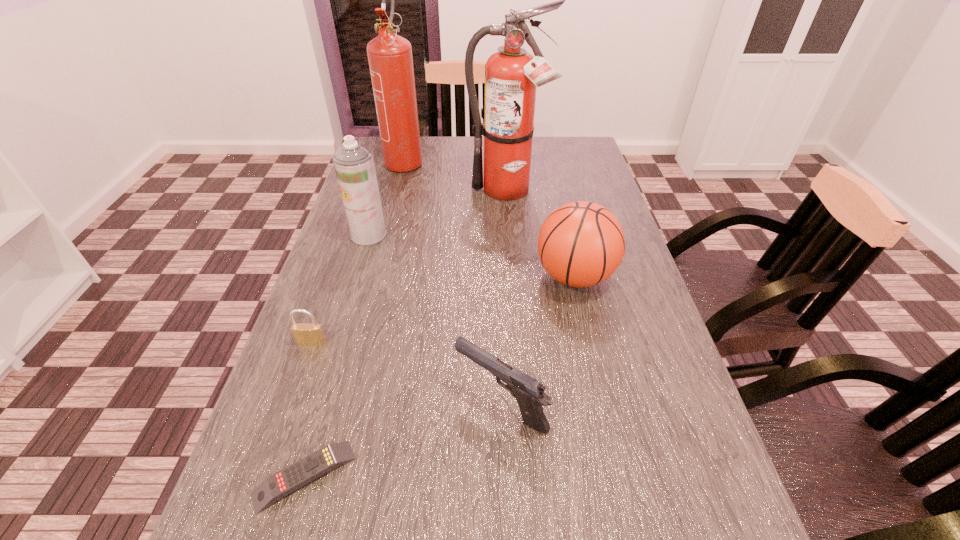
Identify the location of the nearest object. (298, 474).

This screenshot has height=540, width=960. Identify the location of remote control. (298, 474).

Where is `free space located 0.190m from the nozzle of the left fire extinguisher`? free space located 0.190m from the nozzle of the left fire extinguisher is located at coordinates (392, 213).

You are a GUI agent. You are given a task and a screenshot of the screen. Output one action in this format:
    pyautogui.click(x=<x>, y=<y>)
    Task: Click on the vacant space located 0.140m from the nozzle of the right fire extinguisher
    
    Given the screenshot: What is the action you would take?
    point(510,241)

Identify the location of vacant space situated 0.350m on the front of the aerosol can. (332, 356).

This screenshot has width=960, height=540. What are the coordinates of `vacant space situated on the left of the fourth tallest object` in the screenshot? It's located at (384, 276).

You are a GUI agent. You are given a task and a screenshot of the screen. Output one action in this format:
    pyautogui.click(x=<x>, y=<y>)
    Task: Click on the vacant space located at the muzzle of the third shortest object
    Image resolution: width=960 pixels, height=540 pixels.
    Given the screenshot: What is the action you would take?
    pyautogui.click(x=297, y=403)

Find the location of a particular element. The height and width of the screenshot is (540, 960). vacant space located at the muzzle of the third shortest object is located at coordinates (422, 403).

The image size is (960, 540). What are the coordinates of `blank space located 0.070m at the muzzle of the third shortest object` in the screenshot? It's located at (418, 403).

Find the location of `blank space located 0.180m on the front-facing side of the padlock`. blank space located 0.180m on the front-facing side of the padlock is located at coordinates (281, 427).